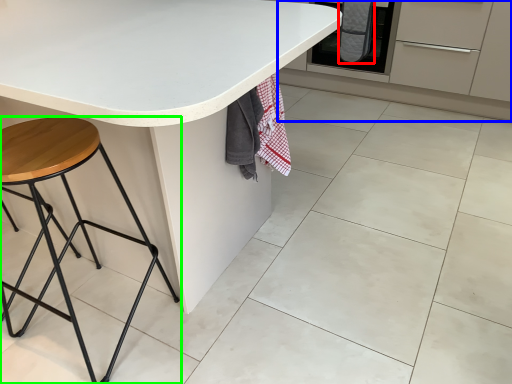
Question: Which object is positioned farthest from blanket (highlighted by a red box)? Select from cabinetry (highlighted by a blue box) and stool (highlighted by a green box).

Choices:
 (A) cabinetry
 (B) stool

Answer: (B)